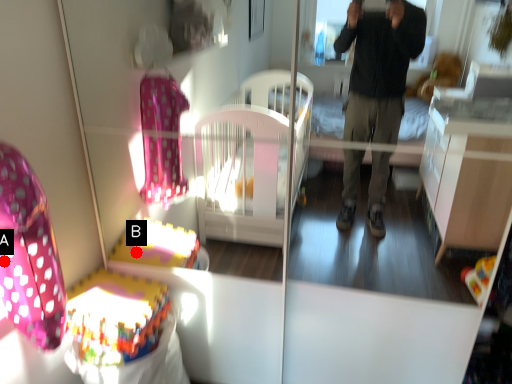
Question: Two points are circled on the image, labeled by A and B beside each circle. Which point is farther from the camera taking this photo?

Choices:
 (A) A is further
 (B) B is further

Answer: (B)